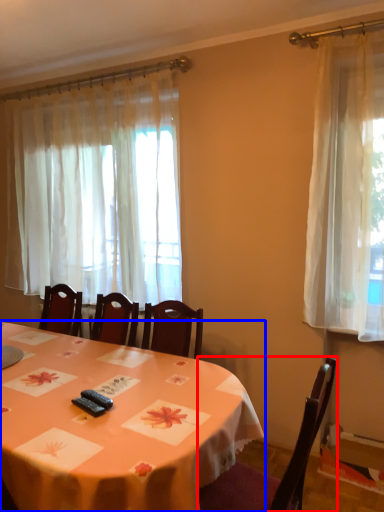
Question: Which object appears farthest to the camera in this image, chair (highlighted by a red box) or table (highlighted by a blue box)?

Choices:
 (A) chair
 (B) table

Answer: (A)